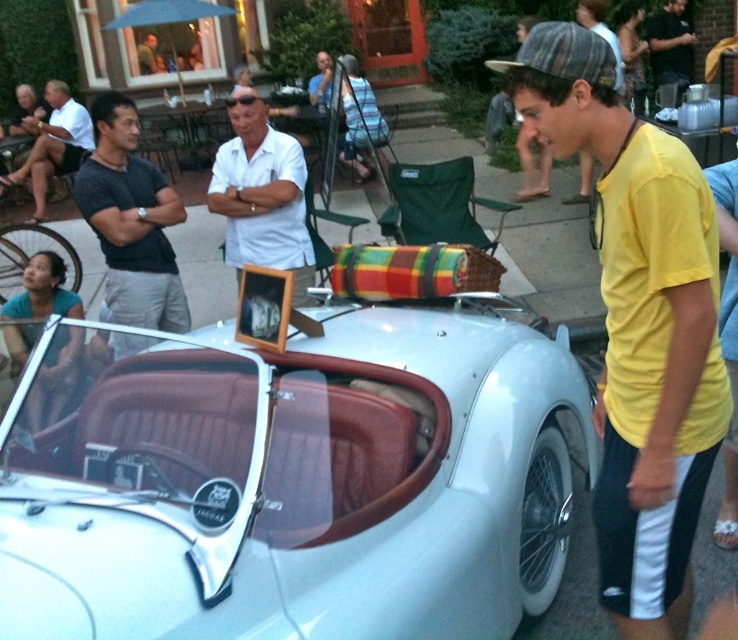
Question: Is white matte shirt at center to the right of white cotton shirt at upper left from the viewer's perspective?

Choices:
 (A) yes
 (B) no

Answer: (A)

Question: Can you confirm if yellow cotton shirt at center is wider than dark blue jeans at upper right?

Choices:
 (A) no
 (B) yes

Answer: (A)

Question: Where is yellow cotton shirt at center located in relation to dark gray fabric shirt at left in the image?

Choices:
 (A) below
 (B) above

Answer: (A)

Question: Based on their relative distances, which object is nearer to the white matte shirt at center?

Choices:
 (A) dark gray fabric shirt at left
 (B) dark blue jeans at upper right

Answer: (A)

Question: Which is nearer to the dark blue jeans at upper right?

Choices:
 (A) white matte shirt at center
 (B) silver metallic car at center
 (C) yellow cotton shirt at center

Answer: (A)

Question: Estimate the real-world distances between objects in this image. Which object is closer to the white cotton shirt at upper left?

Choices:
 (A) dark blue jeans at upper right
 (B) white matte shirt at center
 (C) silver metallic car at center
 (D) dark gray fabric shirt at left

Answer: (B)